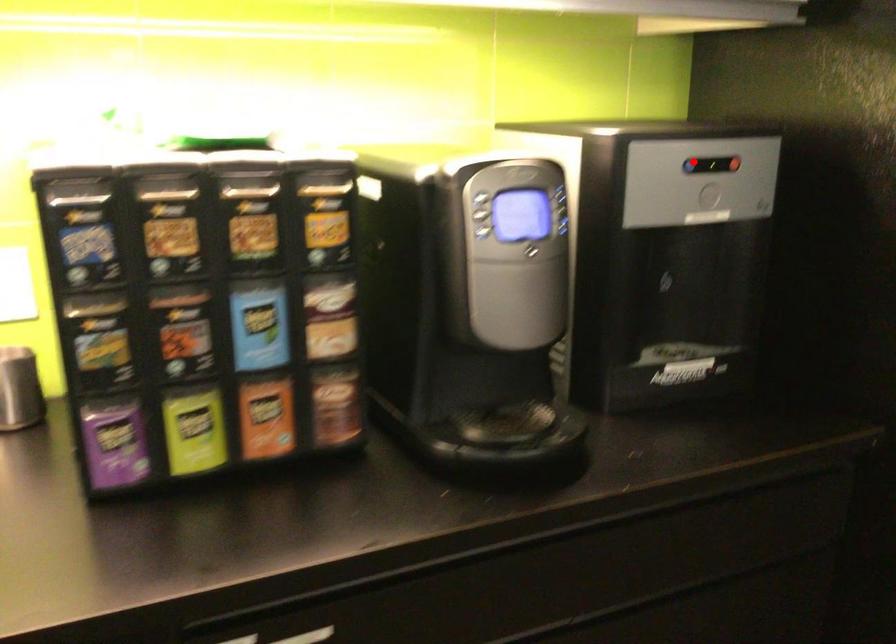
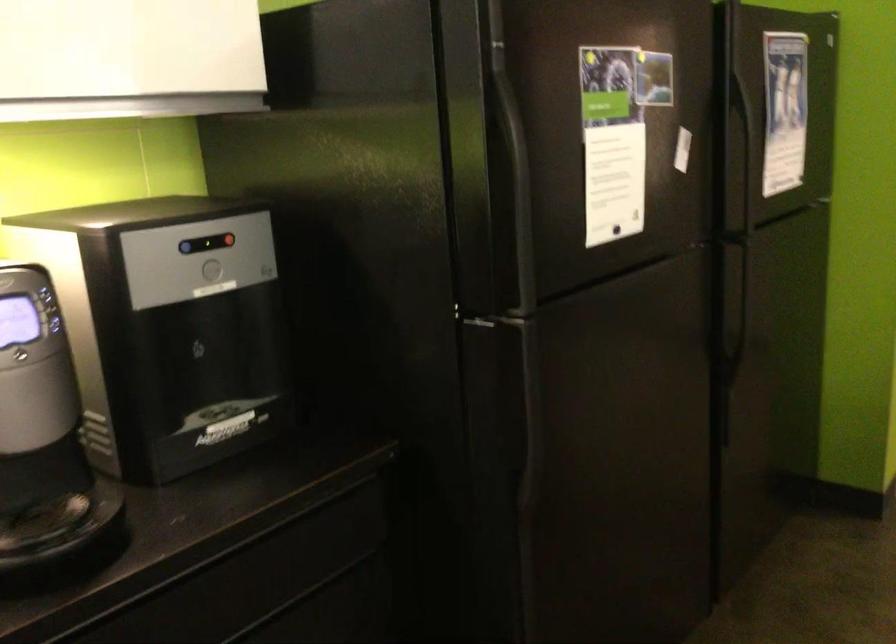
Locate, in the second image, the point that corresponds to the highlighted location in the first image.

(186, 247)